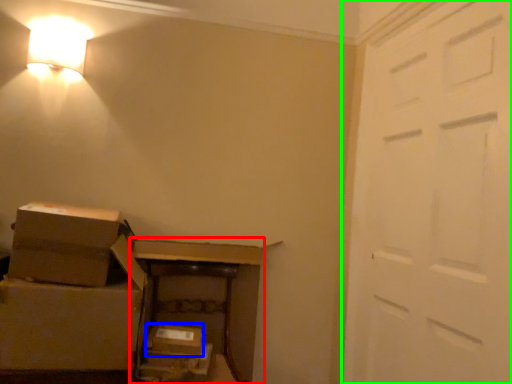
Question: Considering the real-world distances, which object is closest to furniture (highlighted by a red box)? storage box (highlighted by a blue box) or door (highlighted by a green box).

Choices:
 (A) storage box
 (B) door

Answer: (A)